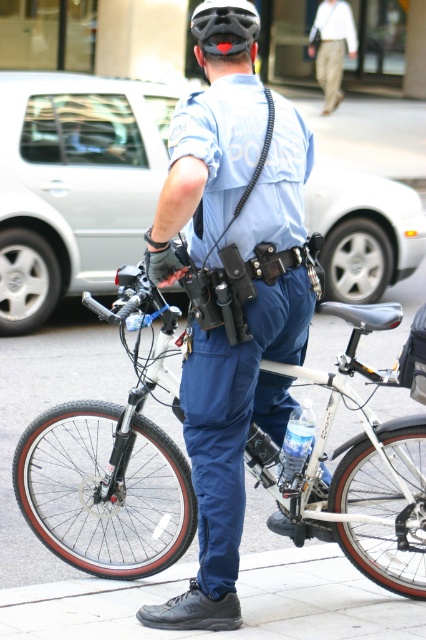
You are a detective analyzing the scene. The khaki cotton pants at upper center and the black matte helmet at center are both in the image. Which object is positioned to the right of the other?

The khaki cotton pants at upper center are to the right of the black matte helmet at center.

You are a police officer standing on a sidewalk next to a bicycle. You need to secure both the silver metallic bicycle at center and the black matte helmet at center. Which object should you secure first if you want to start with the one closer to your right side?

The silver metallic bicycle at center is to the left of the black matte helmet at center, so the black matte helmet at center is closer to your right side and should be secured first.